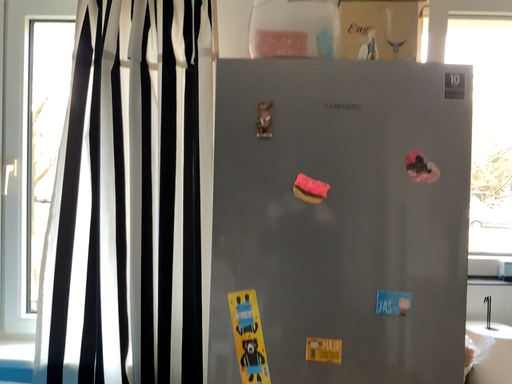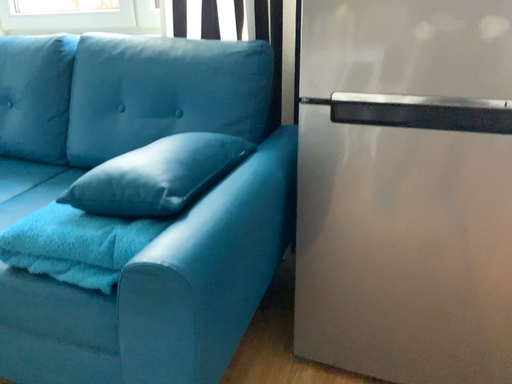
Question: How did the camera likely rotate when shooting the video?

Choices:
 (A) rotated downward
 (B) rotated upward

Answer: (A)